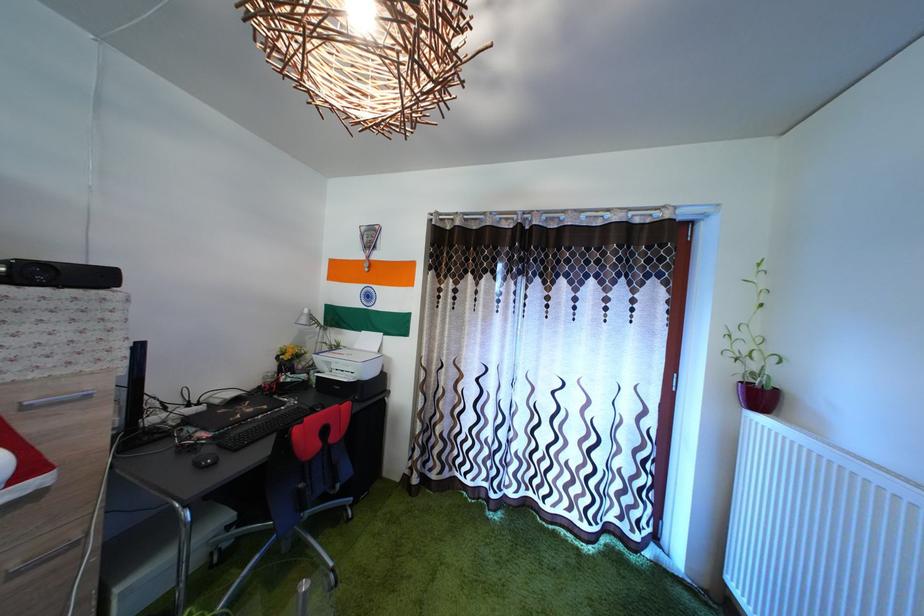
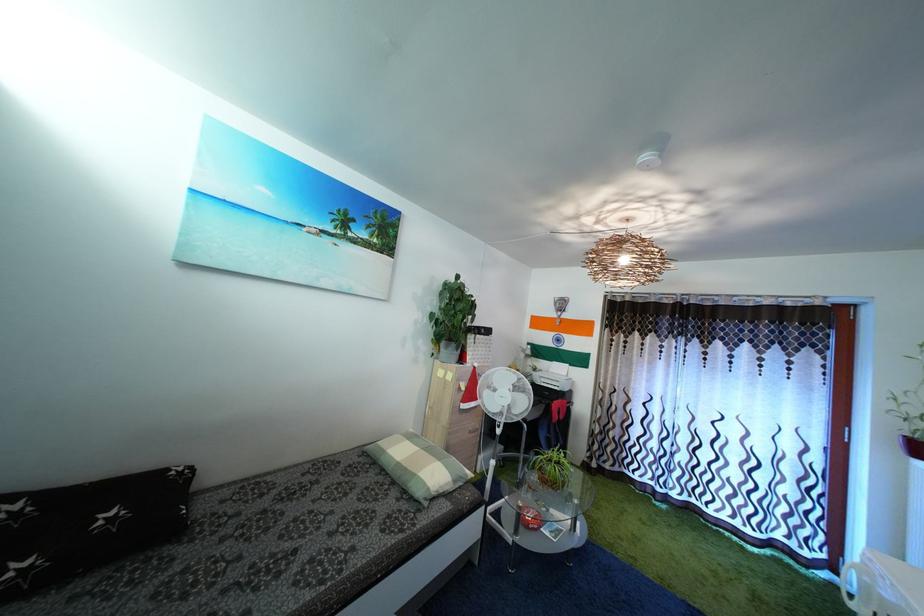
In a continuous first-person perspective shot, in which direction is the camera moving?

The cameraman moved toward left, backward.